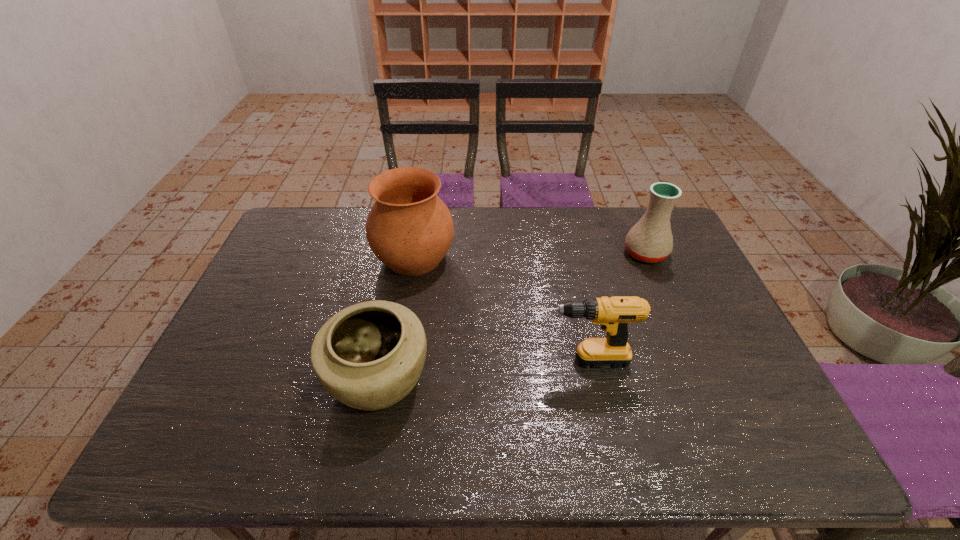
This screenshot has width=960, height=540. I want to click on unoccupied area between the rightmost pottery and the nearest pottery, so click(512, 316).

I want to click on unoccupied position between the drill and the nearest pottery, so point(477,370).

At what (x,y) coordinates should I click in order to perform the action: click on free space that is in between the nearest pottery and the rightmost object. Please return your answer as a coordinate pair (x, y). Looking at the image, I should click on (512, 316).

The width and height of the screenshot is (960, 540). Find the location of `object that is the second closest to the nearest pottery`. object that is the second closest to the nearest pottery is located at coordinates (613, 314).

Where is `object that can be found as the closest to the drill`? The height and width of the screenshot is (540, 960). object that can be found as the closest to the drill is located at coordinates (369, 356).

You are a GUI agent. You are given a task and a screenshot of the screen. Output one action in this format:
    pyautogui.click(x=<x>, y=<y>)
    Task: Click on the closest pottery to the rightmost object
    The height and width of the screenshot is (540, 960).
    Given the screenshot: What is the action you would take?
    pyautogui.click(x=409, y=228)

Choose which pottery is the second nearest neighbor to the shortest pottery. Please provide its 2D coordinates. Your answer should be formatted as a tuple, i.e. [(x, y)], where the tuple contains the x and y coordinates of a point satisfying the conditions above.

[(650, 240)]

Locate an element on the screen. The height and width of the screenshot is (540, 960). vacant space that satisfies the following two spatial constraints: 1. at the tip of the third object from left to right; 2. on the front side of the shortest object is located at coordinates (579, 379).

Where is `free spot that satisfies the following two spatial constraints: 1. at the tip of the drill; 2. on the front side of the nearest pottery`? Image resolution: width=960 pixels, height=540 pixels. free spot that satisfies the following two spatial constraints: 1. at the tip of the drill; 2. on the front side of the nearest pottery is located at coordinates (579, 379).